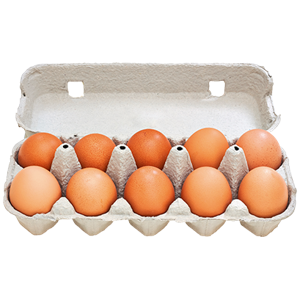
At what (x,y) coordinates should I click in order to perform the action: click on dividers. Please return your answer as a coordinate pair (x, y). Looking at the image, I should click on (66, 159), (120, 158), (179, 159), (233, 160).